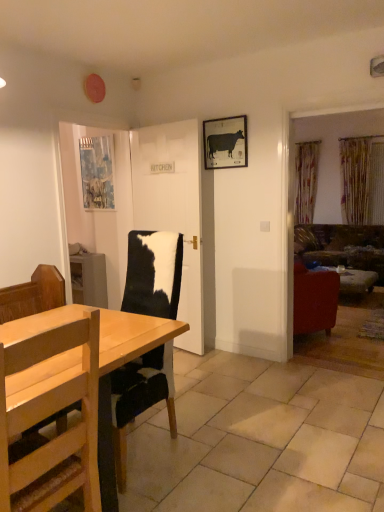
Question: Is matte black cow at upper center, acting as the first picture frame starting from the front, beside white glossy door at center?

Choices:
 (A) no
 (B) yes

Answer: (A)

Question: Is matte black cow at upper center, arranged as the 2th picture frame when viewed from the back, not near white glossy door at center?

Choices:
 (A) no
 (B) yes

Answer: (A)

Question: Is matte black cow at upper center, marked as the 1th picture frame in a right-to-left arrangement, at the left side of white glossy door at center?

Choices:
 (A) yes
 (B) no

Answer: (B)

Question: Considering the relative sizes of matte black cow at upper center, arranged as the 2th picture frame when viewed from the left, and white glossy door at center in the image provided, is matte black cow at upper center, arranged as the 2th picture frame when viewed from the left, bigger than white glossy door at center?

Choices:
 (A) no
 (B) yes

Answer: (A)

Question: Does matte black cow at upper center, arranged as the 2th picture frame when viewed from the back, appear on the right side of white glossy door at center?

Choices:
 (A) yes
 (B) no

Answer: (A)

Question: Does matte black cow at upper center, acting as the first picture frame starting from the front, have a lesser width compared to white glossy door at center?

Choices:
 (A) no
 (B) yes

Answer: (B)

Question: Is blue textured fabric at upper left, which is counted as the second picture frame, starting from the right, facing away from velvet green sofa at right?

Choices:
 (A) yes
 (B) no

Answer: (B)

Question: Is velvet green sofa at right completely or partially inside blue textured fabric at upper left, which is counted as the second picture frame, starting from the right?

Choices:
 (A) yes
 (B) no

Answer: (B)

Question: Does blue textured fabric at upper left, which is counted as the second picture frame, starting from the right, appear on the right side of velvet green sofa at right?

Choices:
 (A) yes
 (B) no

Answer: (B)

Question: Does blue textured fabric at upper left, the first picture frame when ordered from left to right, have a lesser width compared to velvet green sofa at right?

Choices:
 (A) no
 (B) yes

Answer: (B)

Question: Does blue textured fabric at upper left, which appears as the second picture frame when viewed from the front, have a greater height compared to velvet green sofa at right?

Choices:
 (A) yes
 (B) no

Answer: (B)

Question: Is blue textured fabric at upper left, positioned as the 1th picture frame in back-to-front order, positioned in front of velvet green sofa at right?

Choices:
 (A) no
 (B) yes

Answer: (B)

Question: Is velvet green sofa at right oriented towards white glossy door at center?

Choices:
 (A) yes
 (B) no

Answer: (A)